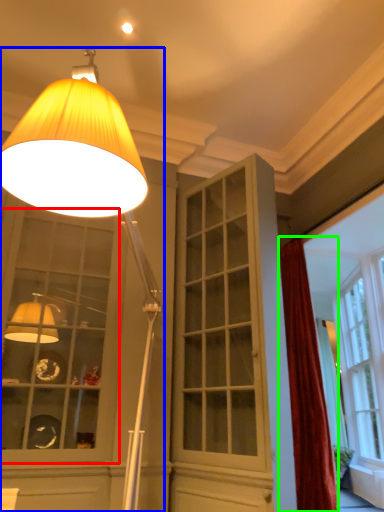
Question: Based on their relative distances, which object is farther from window (highlighted by a red box)? Choose from lamp (highlighted by a blue box) and curtain (highlighted by a green box).

Choices:
 (A) lamp
 (B) curtain

Answer: (A)